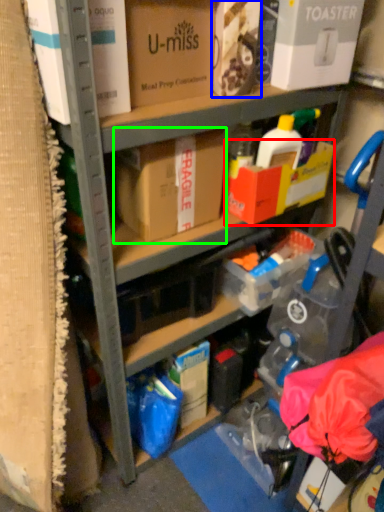
Question: Which object is the closest to the box (highlighted by a red box)? Choose among these: box (highlighted by a blue box) or box (highlighted by a green box).

Choices:
 (A) box
 (B) box

Answer: (B)